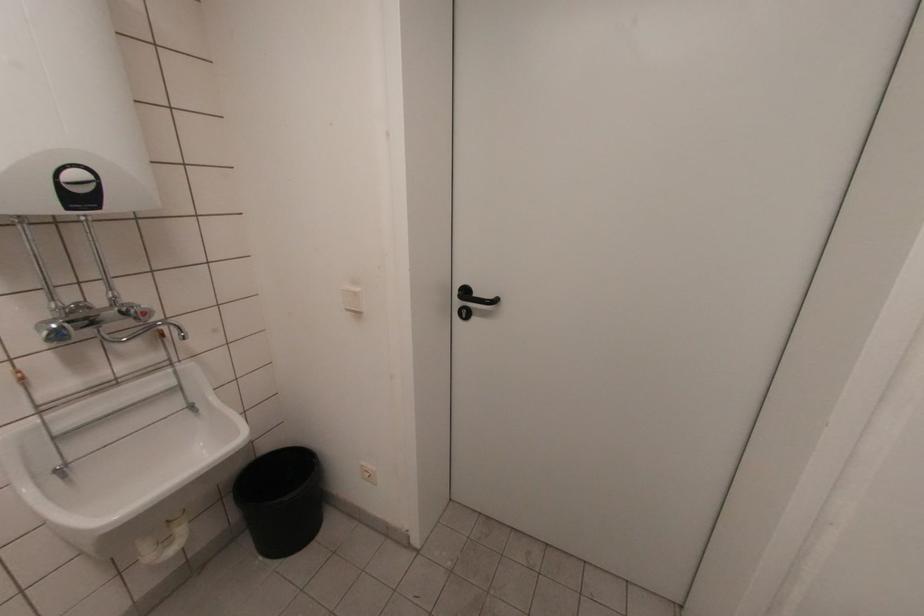
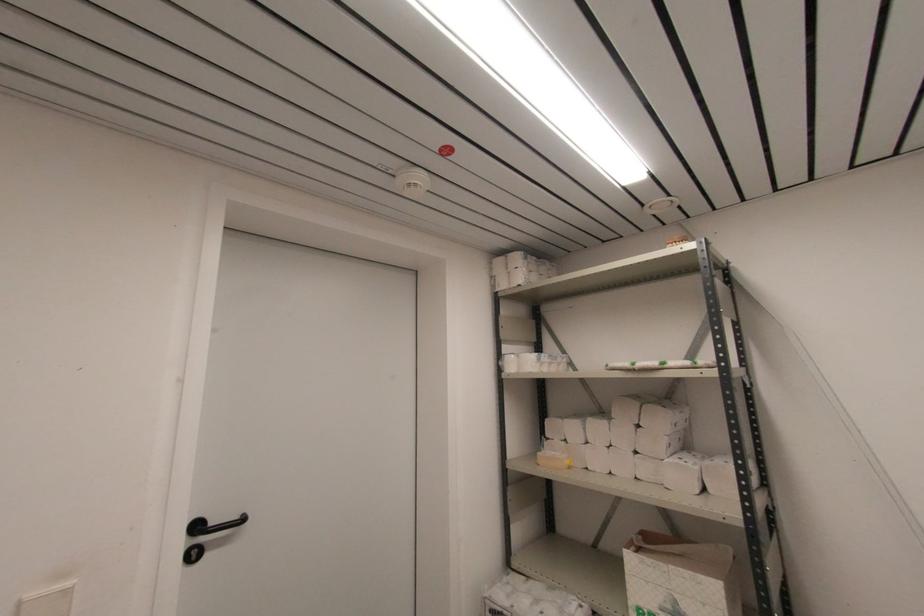
Find the pixel in the second image that matches (x=465, y=315) in the first image.

(196, 557)